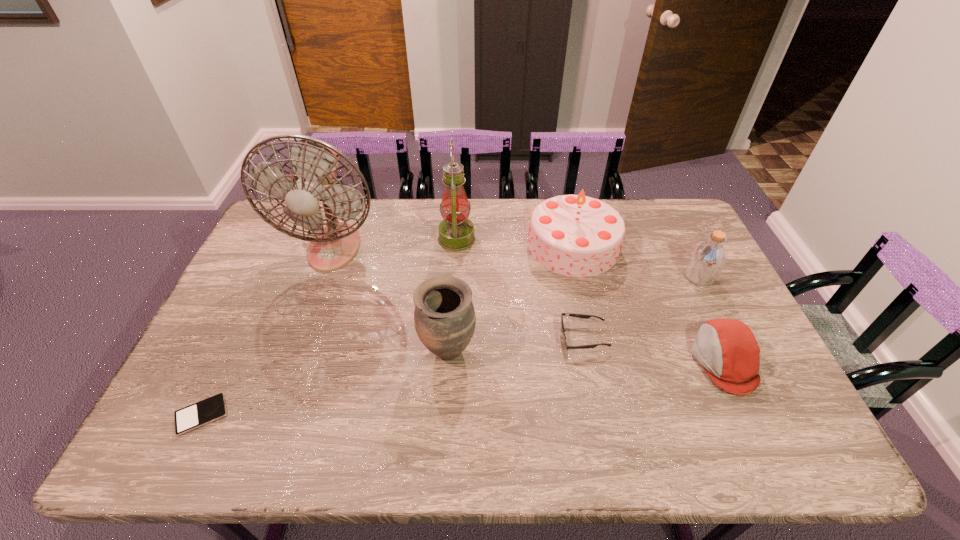
This screenshot has width=960, height=540. What are the coordinates of `fan that is at the far edge` in the screenshot? It's located at (314, 163).

At what (x,y) coordinates should I click in order to perform the action: click on oil lamp located at the far edge. Please return your answer as a coordinate pair (x, y). The height and width of the screenshot is (540, 960). Looking at the image, I should click on (456, 232).

At what (x,y) coordinates should I click in order to perform the action: click on birthday cake that is positioned at the far edge. Please return your answer as a coordinate pair (x, y). Looking at the image, I should click on 573,235.

In order to click on object present at the near edge in this screenshot , I will do `click(213, 408)`.

What are the coordinates of `fan at the left edge` in the screenshot? It's located at (314, 163).

The image size is (960, 540). Identify the location of iPod that is positioned at the left edge. (213, 408).

Find the location of a particular element. The image size is (960, 540). bottle that is positioned at the right edge is located at coordinates (707, 260).

Locate an element on the screen. cap present at the right edge is located at coordinates (729, 351).

The height and width of the screenshot is (540, 960). What are the coordinates of `object positioned at the far left corner` in the screenshot? It's located at (314, 163).

This screenshot has height=540, width=960. What are the coordinates of `object present at the near left corner` in the screenshot? It's located at pyautogui.click(x=213, y=408).